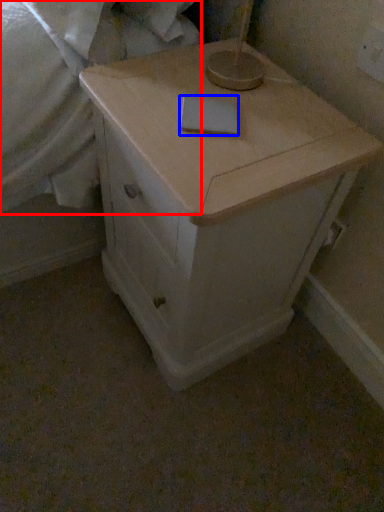
Question: Which of the following is the farthest to the observer, sheet (highlighted by a red box) or notepad (highlighted by a blue box)?

Choices:
 (A) sheet
 (B) notepad

Answer: (B)